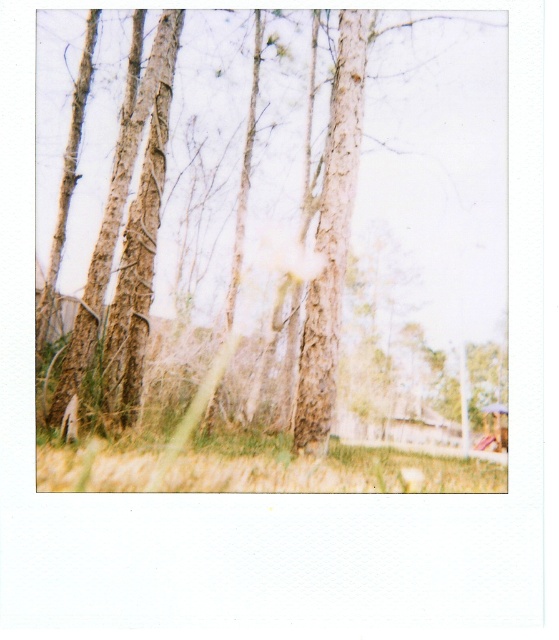
Question: Is rough bark tree at center to the right of green grass at lower center from the viewer's perspective?

Choices:
 (A) yes
 (B) no

Answer: (A)

Question: Which of the following is the closest to the observer?

Choices:
 (A) (93, 436)
 (B) (191, 360)

Answer: (A)

Question: Can you confirm if rough bark tree at center is smaller than green grass at lower center?

Choices:
 (A) no
 (B) yes

Answer: (A)

Question: Can you confirm if rough bark tree at center is thinner than green grass at lower center?

Choices:
 (A) yes
 (B) no

Answer: (B)